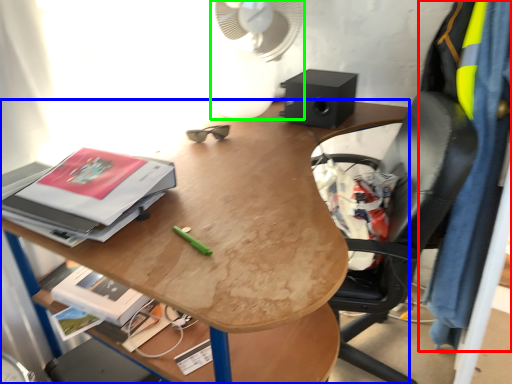
Question: Which object is positioned closest to clothing (highlighted by a red box)? Select from desk (highlighted by a blue box) and mechanical fan (highlighted by a green box).

Choices:
 (A) desk
 (B) mechanical fan

Answer: (A)